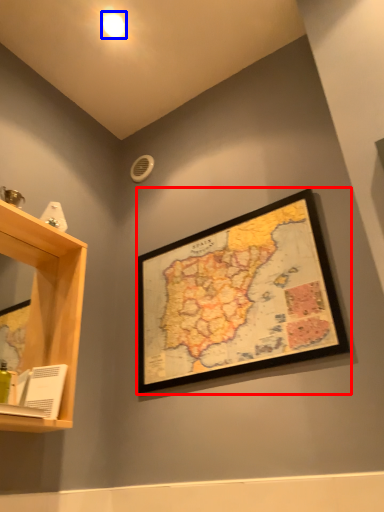
Question: Which object appears farthest to the camera in this image, picture frame (highlighted by a red box) or light (highlighted by a blue box)?

Choices:
 (A) picture frame
 (B) light

Answer: (B)